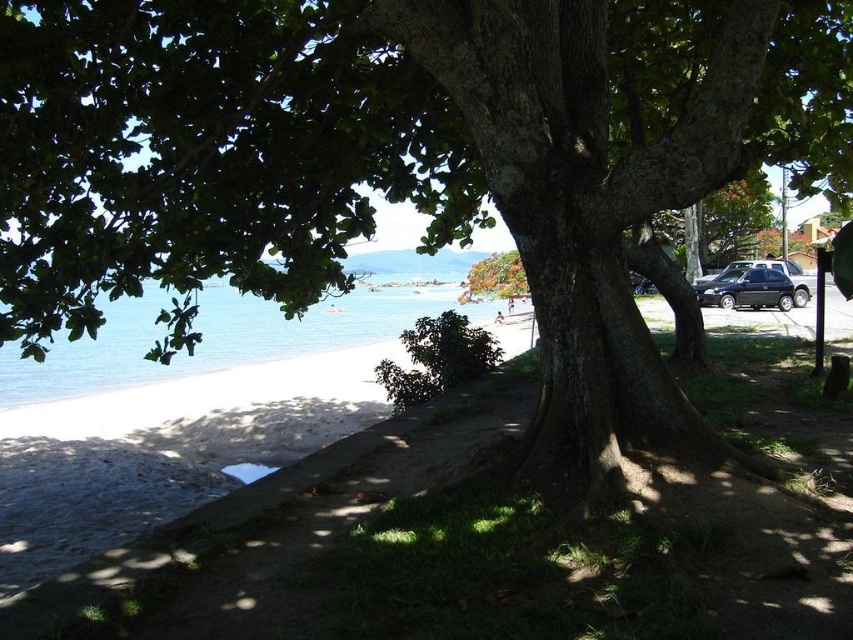
Question: Can you confirm if clear blue water at lower left is positioned above black matte car at right?

Choices:
 (A) yes
 (B) no

Answer: (B)

Question: Is clear blue water at lower left to the left of black matte car at right from the viewer's perspective?

Choices:
 (A) no
 (B) yes

Answer: (B)

Question: Among these objects, which one is nearest to the camera?

Choices:
 (A) black matte car at right
 (B) clear blue water at lower left

Answer: (B)

Question: Does clear blue water at lower left have a lesser width compared to black matte car at right?

Choices:
 (A) yes
 (B) no

Answer: (B)

Question: Which point is closer to the camera?

Choices:
 (A) black matte car at right
 (B) clear blue water at lower left

Answer: (B)